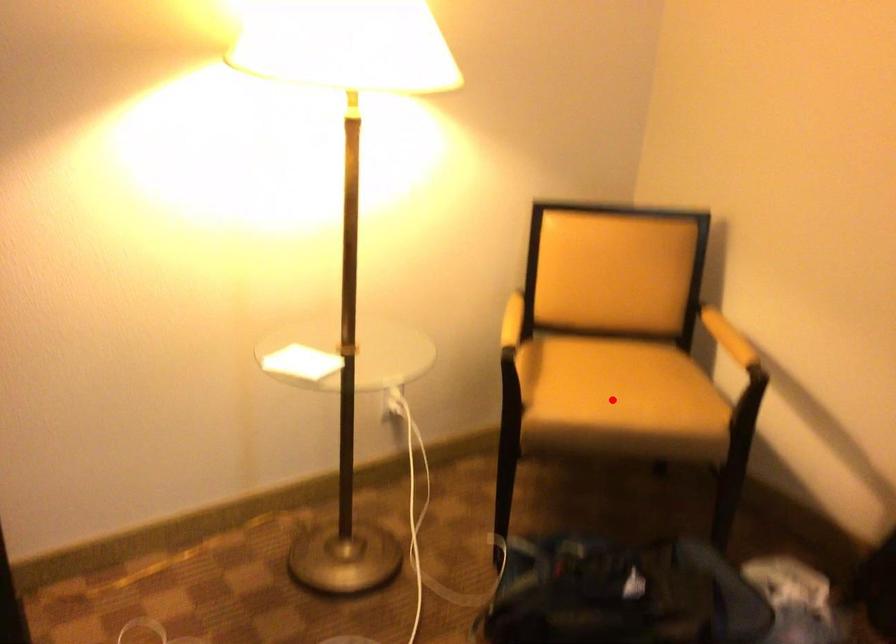
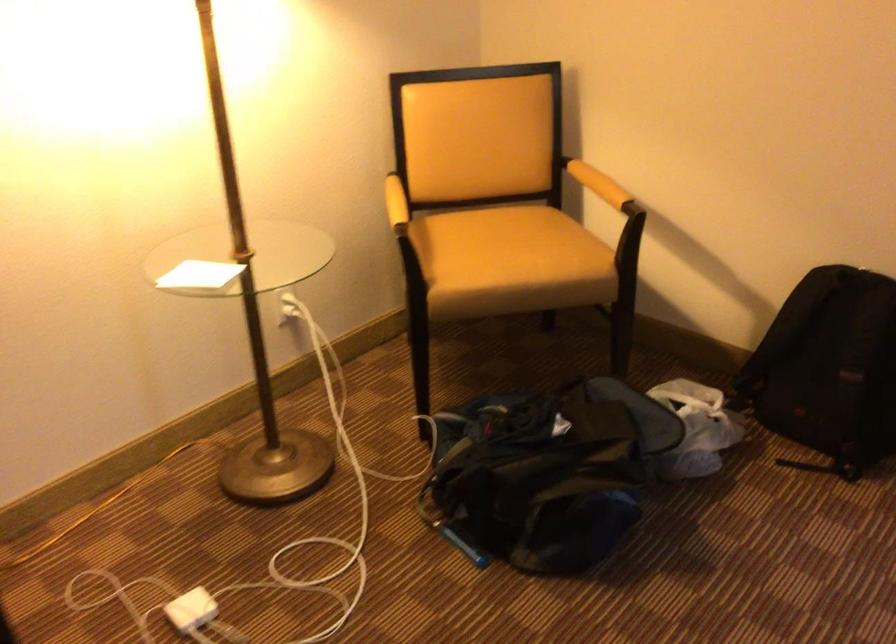
Locate, in the second image, the point that corresponds to the highlighted location in the first image.

(510, 261)